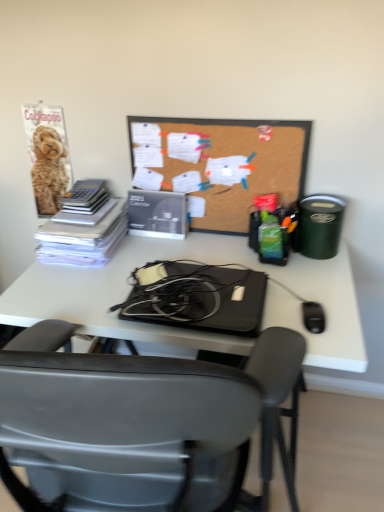
Locate an element on the screen. blank space situated above black matte laptop at center (from a real-world perspective) is located at coordinates (204, 295).